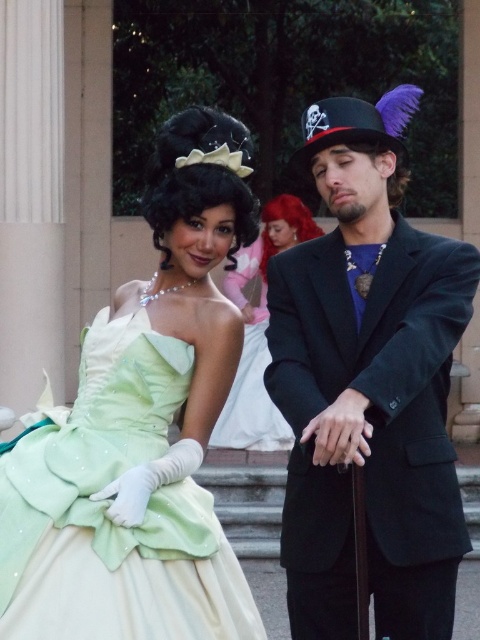
Question: Which of the following is the closest to the observer?

Choices:
 (A) (133, 625)
 (B) (407, 480)
 (C) (275, 216)
 (D) (244, 440)

Answer: (A)

Question: Observing the image, what is the correct spatial positioning of lime satin dress at left in reference to matte green dress at center?

Choices:
 (A) right
 (B) left

Answer: (B)

Question: Among these objects, which one is farthest from the camera?

Choices:
 (A) brown fuzzy wig at upper right
 (B) matte green dress at center
 (C) lime satin dress at left

Answer: (B)

Question: Among these objects, which one is farthest from the camera?

Choices:
 (A) shiny black coat at center
 (B) vivid red wig at upper center
 (C) lime satin dress at left

Answer: (B)

Question: Can you confirm if matte green dress at center is positioned above vivid red wig at upper center?

Choices:
 (A) yes
 (B) no

Answer: (B)

Question: Does vivid red wig at upper center have a smaller size compared to brown fuzzy wig at upper right?

Choices:
 (A) no
 (B) yes

Answer: (A)